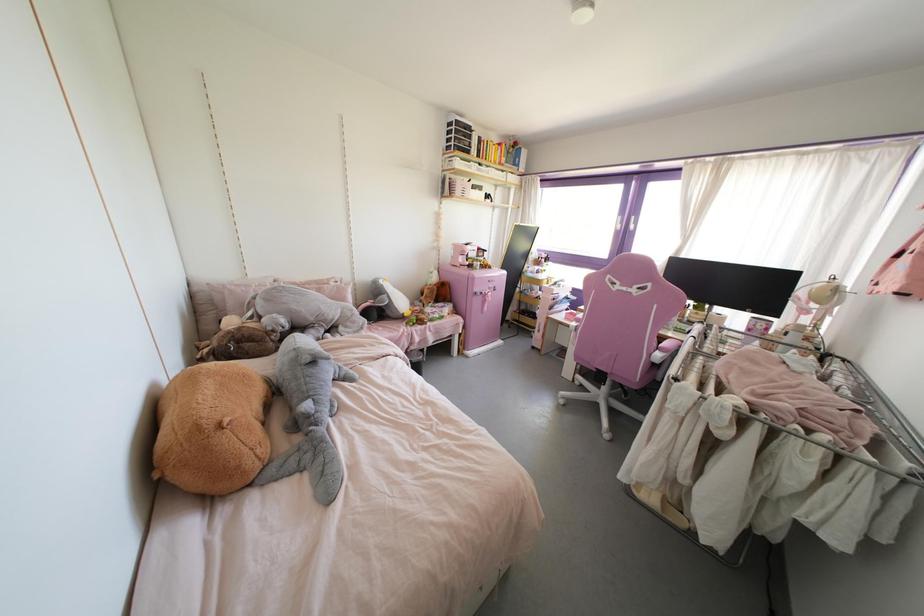
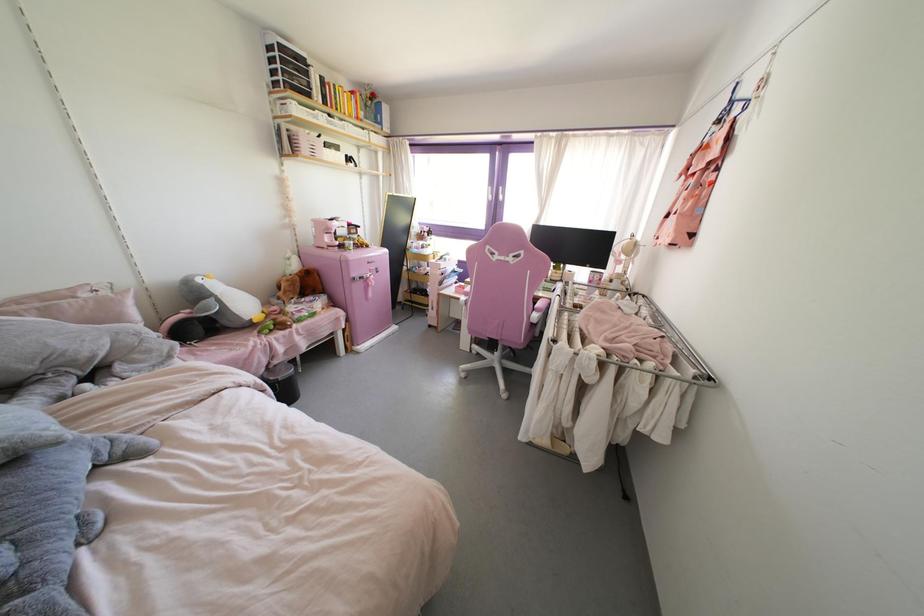
Find the pixel in the second image that matches point 845,360 in the first image.

(642, 294)